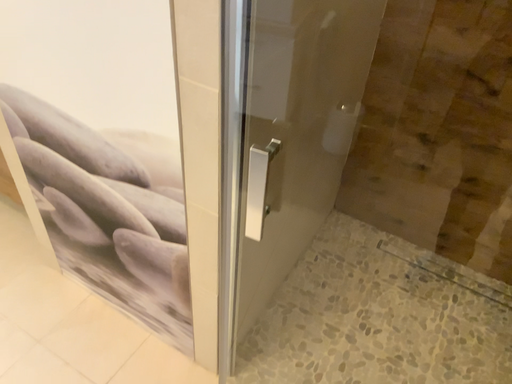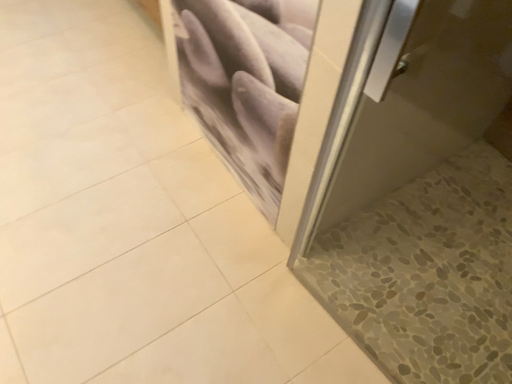
Question: Which way did the camera rotate in the video?

Choices:
 (A) rotated left
 (B) rotated right

Answer: (A)